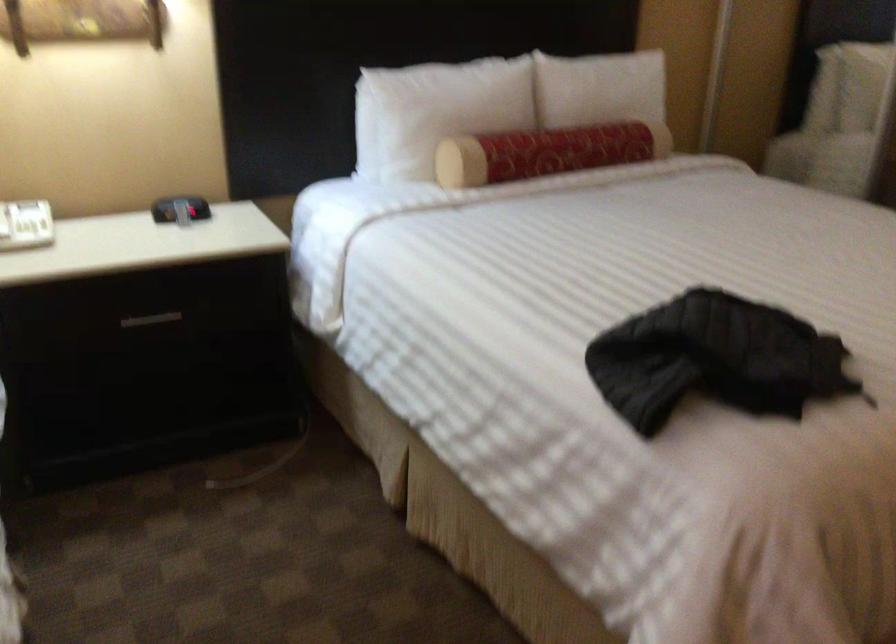
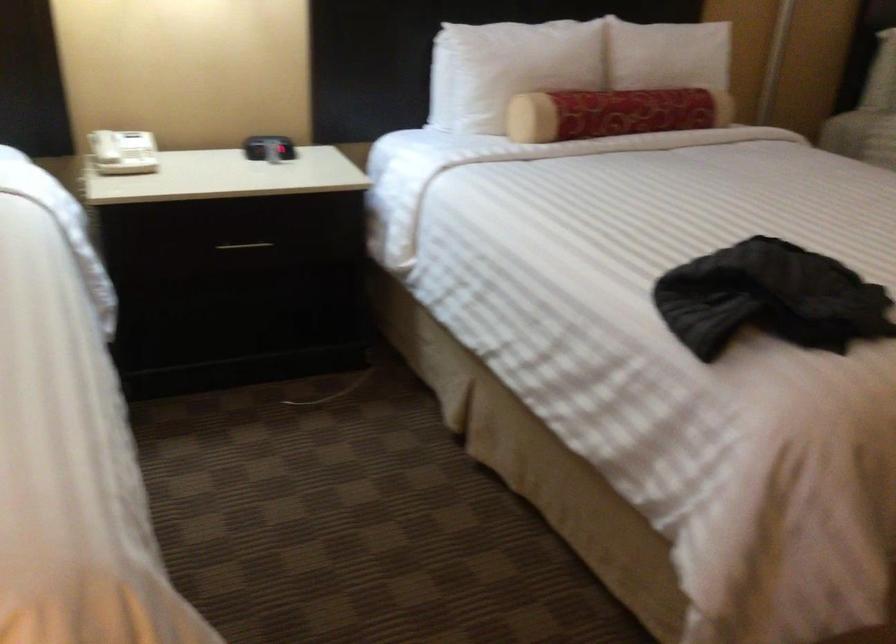
Question: Based on the continuous images, in which direction is the camera rotating? Reply with the corresponding letter.

Choices:
 (A) Left
 (B) Right
 (C) Up
 (D) Down

Answer: (D)